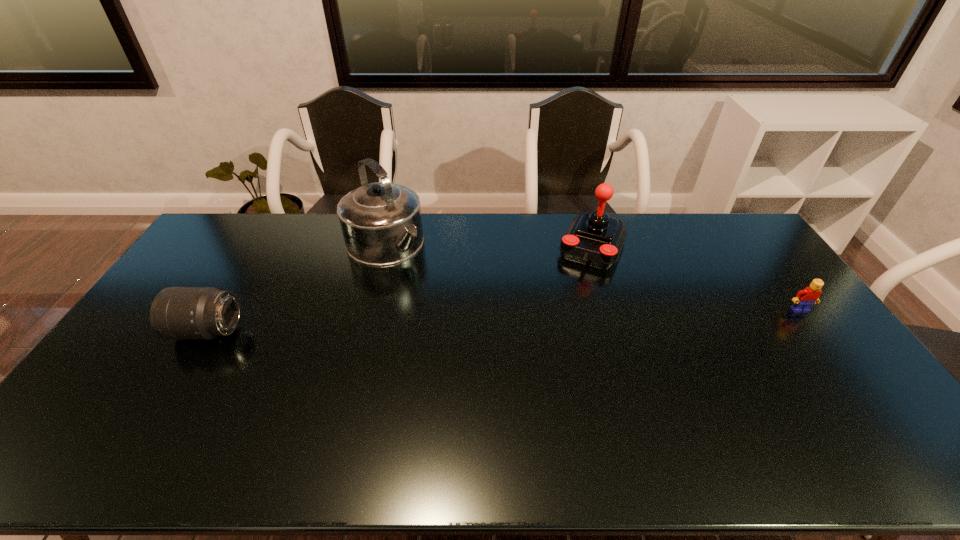
I want to click on blank space located 0.200m with the spout at the front of the kettle, so click(440, 298).

You are a GUI agent. You are given a task and a screenshot of the screen. Output one action in this format:
    pyautogui.click(x=<x>, y=<y>)
    Task: Click on the vacant space situated with the spout at the front of the kettle
    The image size is (960, 540).
    Given the screenshot: What is the action you would take?
    pyautogui.click(x=442, y=300)

Locate an element on the screen. This screenshot has width=960, height=540. free space located with the spout at the front of the kettle is located at coordinates (422, 282).

Locate an element on the screen. The height and width of the screenshot is (540, 960). free space located 0.180m on the base of the third shortest object is located at coordinates click(568, 303).

Image resolution: width=960 pixels, height=540 pixels. In order to click on free point located on the base of the third shortest object in this screenshot , I will do `click(553, 338)`.

The image size is (960, 540). What are the coordinates of `free space located 0.130m on the base of the third shortest object` in the screenshot? It's located at (573, 293).

This screenshot has height=540, width=960. I want to click on kettle that is at the far edge, so click(x=381, y=223).

Locate an element on the screen. This screenshot has height=540, width=960. joystick at the far edge is located at coordinates (596, 239).

This screenshot has width=960, height=540. I want to click on object that is at the left edge, so click(177, 313).

Find the location of a particular element. object present at the right edge is located at coordinates (x=804, y=299).